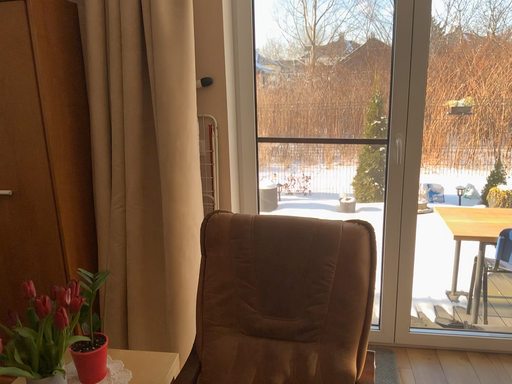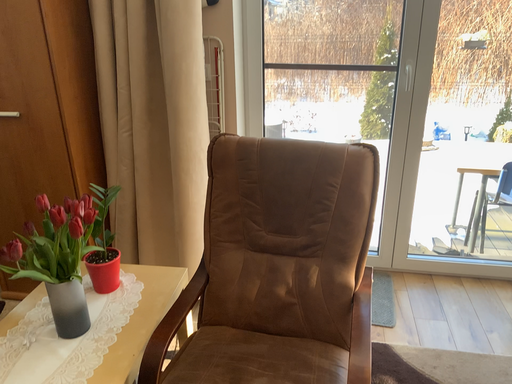
Question: How did the camera likely rotate when shooting the video?

Choices:
 (A) rotated downward
 (B) rotated upward

Answer: (A)